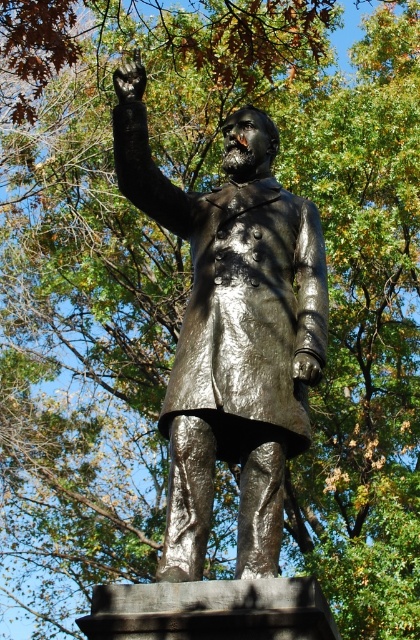
Is shiny bronze statue at center wider than shiny black glove at upper center?

Correct, the width of shiny bronze statue at center exceeds that of shiny black glove at upper center.

Does shiny bronze statue at center come behind shiny black glove at upper center?

No, it is not.

Who is more forward, (220,451) or (123,74)?

Positioned in front is point (220,451).

The image size is (420, 640). Identify the location of shiny bronze statue at center. (233, 336).